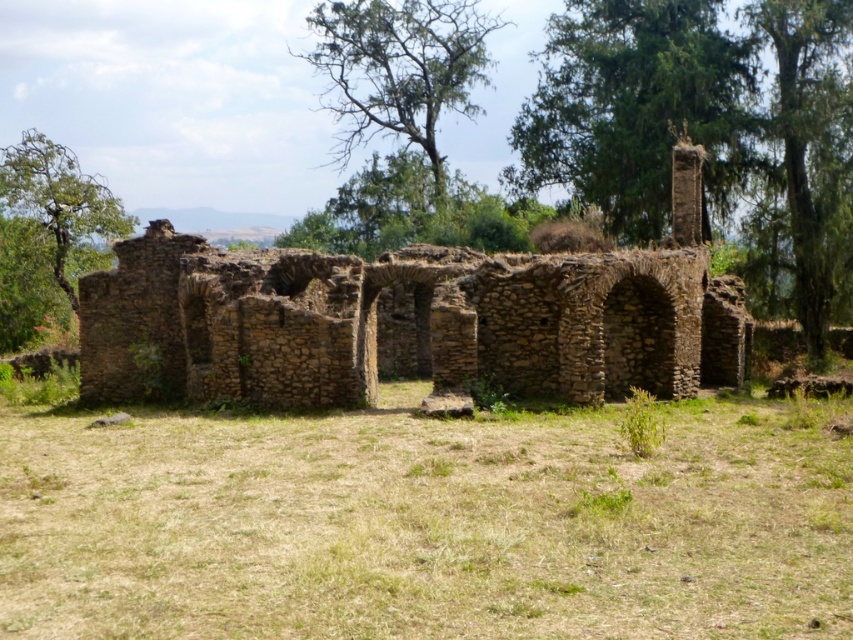
Question: Is green leafy tree at upper right wider than bare wood tree at upper center?

Choices:
 (A) no
 (B) yes

Answer: (A)

Question: Among these points, which one is nearest to the camera?

Choices:
 (A) (445, 49)
 (B) (596, 163)
 (C) (798, 157)

Answer: (C)

Question: Where is brown stone ruins at center located in relation to bare wood tree at upper center in the image?

Choices:
 (A) above
 (B) below

Answer: (B)

Question: Considering the real-world distances, which object is farthest from the green leafy tree at upper left?

Choices:
 (A) brown stone ruins at center
 (B) green leafy tree at upper right
 (C) brown dry grass at center

Answer: (C)

Question: Which object is positioned closest to the green leafy tree at upper center?

Choices:
 (A) brown stone ruins at center
 (B) green leafy tree at upper left

Answer: (A)

Question: Can you confirm if bare wood tree at upper center is positioned below green leafy tree at upper left?

Choices:
 (A) yes
 (B) no

Answer: (B)